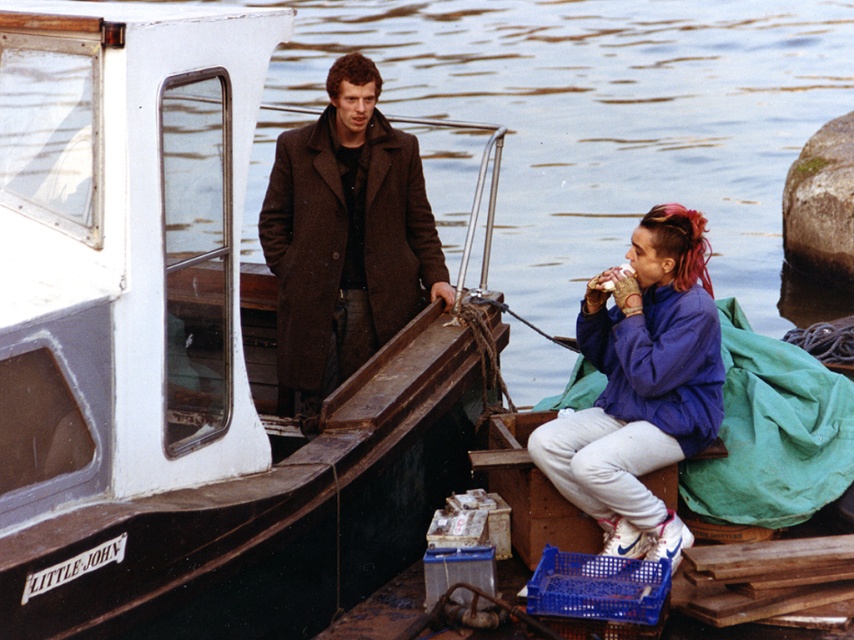
Does white painted wood boat at center appear on the right side of purple fleece jacket at lower right?

Incorrect, white painted wood boat at center is not on the right side of purple fleece jacket at lower right.

Does white painted wood boat at center appear under purple fleece jacket at lower right?

Yes.

Between point (89, 225) and point (670, 259), which one is positioned behind?

The point (670, 259) is behind.

This screenshot has height=640, width=854. I want to click on white painted wood boat at center, so click(179, 353).

Does white painted wood boat at center have a greater height compared to brown wool coat at left?

Yes.

Does point (399, 524) come farther from viewer compared to point (295, 236)?

No, it is in front of (295, 236).

Which is in front, point (97, 218) or point (278, 324)?

Point (97, 218) is more forward.

Where is `white painted wood boat at center`? white painted wood boat at center is located at coordinates (179, 353).

Is brown wool coat at left above purple fleece jacket at lower right?

Yes, brown wool coat at left is above purple fleece jacket at lower right.

Can you confirm if brown wool coat at left is thinner than purple fleece jacket at lower right?

Incorrect, brown wool coat at left's width is not less than purple fleece jacket at lower right's.

Does point (360, 237) come closer to viewer compared to point (679, 528)?

No, it is behind (679, 528).

Locate an element on the screen. This screenshot has width=854, height=640. brown wool coat at left is located at coordinates (344, 237).